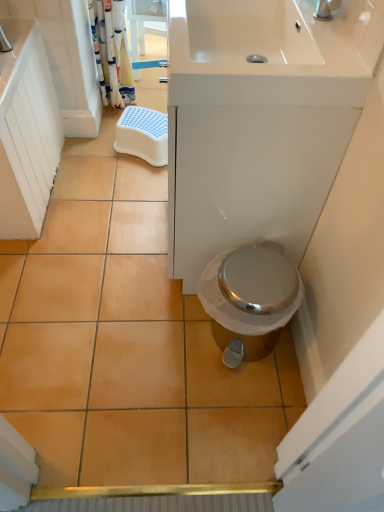
Describe the element at coordinates (271, 53) in the screenshot. I see `white glossy sink at upper center` at that location.

Measure the distance between point (119, 106) and camera.

A distance of 2.32 meters exists between point (119, 106) and camera.

The image size is (384, 512). Find the location of `white glossy sink at upper center`. white glossy sink at upper center is located at coordinates (271, 53).

From a real-world perspective, who is located higher, white fabric shower curtain at upper left or white glossy sink at upper center?

From a 3D spatial view, white glossy sink at upper center is above.

Does point (96, 22) come farther from viewer compared to point (262, 34)?

Yes, it is.

Is white fabric shower curtain at upper left positioned behind white glossy sink at upper center?

Yes.

Would you say white plastic step stool at center is a long distance from white fabric shower curtain at upper left?

No, white plastic step stool at center is not far away from white fabric shower curtain at upper left.

Which is farther, (161, 128) or (107, 83)?

Positioned behind is point (107, 83).

In the image, is white plastic step stool at center on the left side or the right side of white fabric shower curtain at upper left?

Based on their positions, white plastic step stool at center is located to the right of white fabric shower curtain at upper left.

Find the location of a particular element. This screenshot has height=512, width=384. sink lying below the white fabric shower curtain at upper left (from the image's perspective) is located at coordinates (271, 53).

Between white glossy sink at upper center and white fabric shower curtain at upper left, which one has more height?

white fabric shower curtain at upper left.

Could you tell me if white glossy sink at upper center is turned towards white fabric shower curtain at upper left?

No, white glossy sink at upper center is not turned towards white fabric shower curtain at upper left.

Would you say white glossy sink at upper center is outside white fabric shower curtain at upper left?

Indeed, white glossy sink at upper center is completely outside white fabric shower curtain at upper left.

Can you confirm if white fabric shower curtain at upper left is thinner than white plastic step stool at center?

Correct, the width of white fabric shower curtain at upper left is less than that of white plastic step stool at center.

From the picture: Is white fabric shower curtain at upper left in front of white plastic step stool at center?

Yes, white fabric shower curtain at upper left is in front of white plastic step stool at center.

Locate an element on the screen. shower curtain on the left of white plastic step stool at center is located at coordinates (112, 51).

From the image's perspective, would you say white fabric shower curtain at upper left is positioned over white plastic step stool at center?

Yes, from the image's perspective, white fabric shower curtain at upper left is on top of white plastic step stool at center.

Looking at this image, would you say white glossy sink at upper center is part of white plastic step stool at center's contents?

No, white glossy sink at upper center is located outside of white plastic step stool at center.

Would you consider white plastic step stool at center to be distant from white glossy sink at upper center?

They are positioned close to each other.

Which of these two, white plastic step stool at center or white glossy sink at upper center, is wider?

Wider between the two is white glossy sink at upper center.

From a real-world perspective, is white plastic step stool at center physically located above or below white glossy sink at upper center?

From a real-world perspective, white plastic step stool at center is physically below white glossy sink at upper center.

Which of these two, white glossy sink at upper center or white plastic step stool at center, stands taller?

With more height is white plastic step stool at center.

From the picture: Between white glossy sink at upper center and white plastic step stool at center, which one has larger size?

white glossy sink at upper center.

Considering the positions of point (361, 61) and point (148, 150), is point (361, 61) closer or farther from the camera than point (148, 150)?

Point (361, 61) is closer to the camera than point (148, 150).

How different are the orientations of white glossy sink at upper center and white plastic step stool at center in degrees?

The angle between the facing direction of white glossy sink at upper center and the facing direction of white plastic step stool at center is 61.8 degrees.

Locate an element on the screen. Image resolution: width=384 pixels, height=512 pixels. shower curtain on the left of white glossy sink at upper center is located at coordinates (112, 51).

What are the coordinates of `step stool below the white fabric shower curtain at upper left (from the image's perspective)` in the screenshot? It's located at (143, 135).

Considering their positions, is white plastic step stool at center positioned closer to white fabric shower curtain at upper left than white glossy sink at upper center?

white plastic step stool at center.

Based on their spatial positions, is white plastic step stool at center or white fabric shower curtain at upper left further from white glossy sink at upper center?

white fabric shower curtain at upper left is further to white glossy sink at upper center.

From the image, which object appears to be nearer to white plastic step stool at center, white glossy sink at upper center or white fabric shower curtain at upper left?

white fabric shower curtain at upper left is positioned closer to the anchor white plastic step stool at center.

Looking at the image, which one is located closer to white fabric shower curtain at upper left, white glossy sink at upper center or white plastic step stool at center?

white plastic step stool at center is positioned closer to the anchor white fabric shower curtain at upper left.

Considering their positions, is white fabric shower curtain at upper left positioned further to white plastic step stool at center than white glossy sink at upper center?

white glossy sink at upper center lies further to white plastic step stool at center than the other object.

Looking at the image, which one is located closer to white glossy sink at upper center, white fabric shower curtain at upper left or white plastic step stool at center?

Based on the image, white plastic step stool at center appears to be nearer to white glossy sink at upper center.

In order to click on shower curtain between white glossy sink at upper center and white plastic step stool at center along the z-axis in this screenshot , I will do `click(112, 51)`.